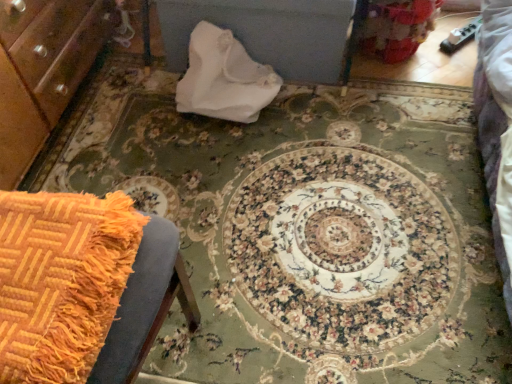
Question: Is point (98, 296) closer or farther from the camera than point (195, 79)?

Choices:
 (A) farther
 (B) closer

Answer: (B)

Question: From their relative heights in the image, would you say orange woven blanket at lower left is taller or shorter than white paper bag at center?

Choices:
 (A) short
 (B) tall

Answer: (A)

Question: Based on their sizes in the image, would you say orange woven blanket at lower left is bigger or smaller than white paper bag at center?

Choices:
 (A) big
 (B) small

Answer: (B)

Question: Is point (228, 54) closer or farther from the camera than point (62, 269)?

Choices:
 (A) closer
 (B) farther

Answer: (B)

Question: From the image's perspective, is white paper bag at center located above or below orange woven blanket at lower left?

Choices:
 (A) below
 (B) above

Answer: (B)

Question: In terms of height, does white paper bag at center look taller or shorter compared to orange woven blanket at lower left?

Choices:
 (A) short
 (B) tall

Answer: (B)

Question: Looking at their shapes, would you say white paper bag at center is wider or thinner than orange woven blanket at lower left?

Choices:
 (A) wide
 (B) thin

Answer: (B)